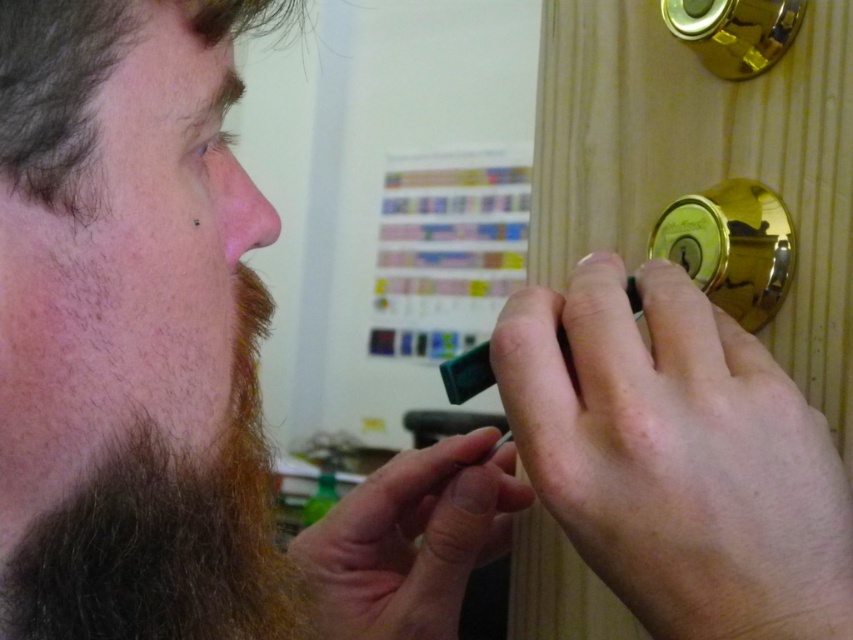
Question: Estimate the real-world distances between objects in this image. Which object is closer to the smooth plastic toothpick at center?

Choices:
 (A) smooth gold doorknob at right
 (B) gold metallic door handle at right

Answer: (A)

Question: In this image, where is matte black eraser at upper center located relative to gold shiny door handle at upper right?

Choices:
 (A) above
 (B) below

Answer: (B)

Question: Can you confirm if brown fuzzy beard at lower left is wider than gold metallic door handle at right?

Choices:
 (A) no
 (B) yes

Answer: (A)

Question: Is brown fuzzy beard at lower left further to the viewer compared to gold metallic door handle at right?

Choices:
 (A) no
 (B) yes

Answer: (A)

Question: Which object is closer to the camera taking this photo?

Choices:
 (A) smooth plastic toothpick at center
 (B) brown fuzzy beard at lower left
 (C) gold metallic door handle at right
 (D) matte black eraser at upper center

Answer: (D)

Question: Which of these objects is positioned closest to the brown fuzzy beard at lower left?

Choices:
 (A) smooth gold doorknob at right
 (B) matte black eraser at upper center
 (C) gold shiny door handle at upper right
 (D) gold metallic door handle at right

Answer: (B)